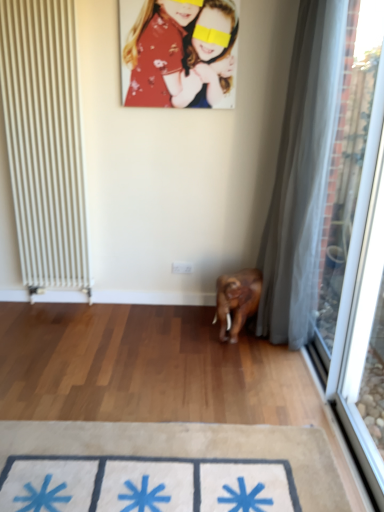
What are the coordinates of `vacant space underneath white metal radiator at left (from a real-world perspective)` in the screenshot? It's located at (59, 303).